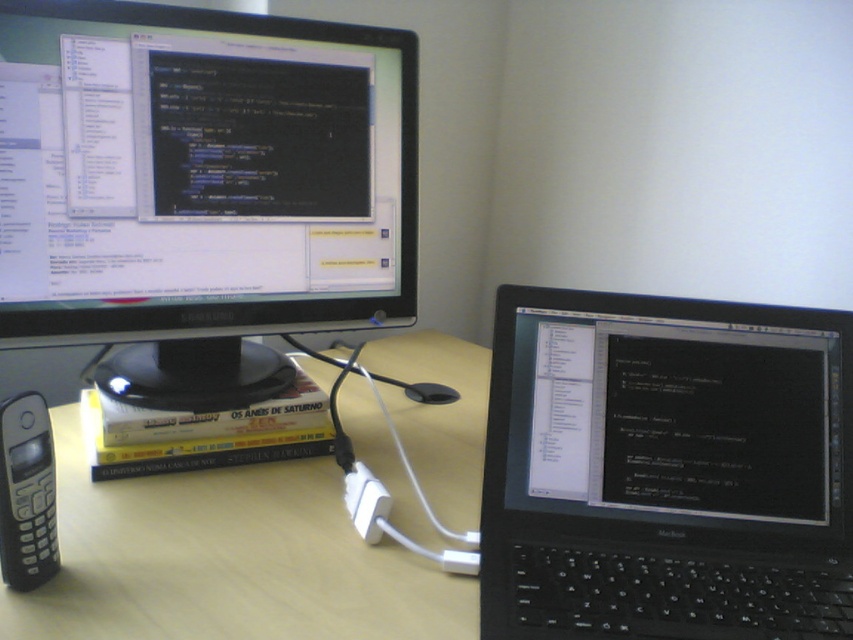
Does black plastic laptop at center have a lesser width compared to black plastic phone at left?

In fact, black plastic laptop at center might be wider than black plastic phone at left.

Which is more to the right, black plastic laptop at center or black plastic phone at left?

From the viewer's perspective, black plastic laptop at center appears more on the right side.

Find the location of a particular element. This screenshot has width=853, height=640. black plastic laptop at center is located at coordinates (665, 468).

Does matte black monitor at upper left come in front of light brown wood computer desk at center?

No, it is behind light brown wood computer desk at center.

Which is behind, point (279, 250) or point (447, 364)?

The point (447, 364) is behind.

Does point (289, 122) lie behind point (405, 490)?

Yes, it is.

At what (x,y) coordinates should I click in order to perform the action: click on matte black monitor at upper left. Please return your answer as a coordinate pair (x, y). Looking at the image, I should click on (200, 189).

Is matte black monitor at upper left thinner than black plastic phone at left?

In fact, matte black monitor at upper left might be wider than black plastic phone at left.

Does matte black monitor at upper left appear over black plastic phone at left?

Correct, matte black monitor at upper left is located above black plastic phone at left.

Does point (209, 392) lie in front of point (49, 552)?

No.

Locate an element on the screen. This screenshot has width=853, height=640. matte black monitor at upper left is located at coordinates (200, 189).